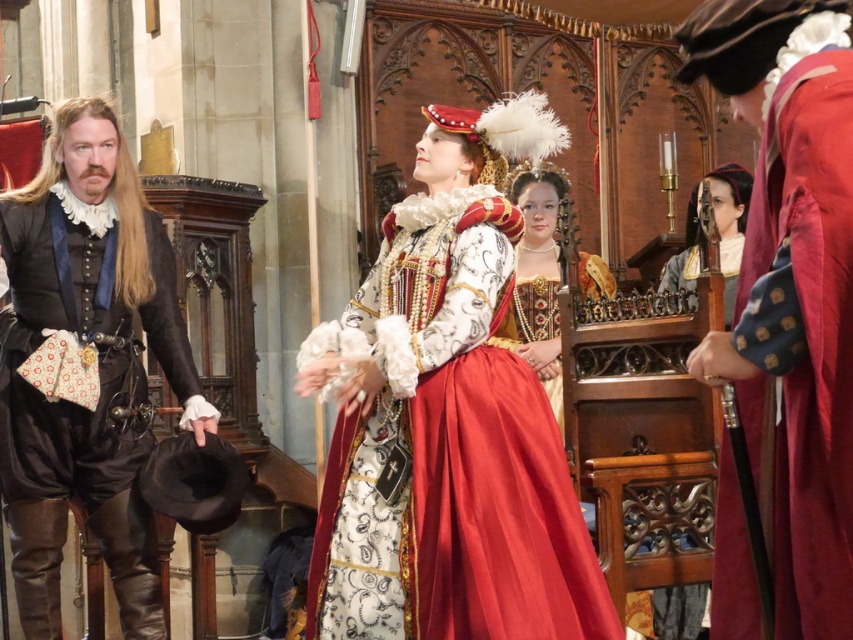
Which of these two, matte white lace dress at center or velvet maroon robe at right, stands shorter?

Standing shorter between the two is velvet maroon robe at right.

Between matte white lace dress at center and velvet maroon robe at right, which one is positioned higher?

velvet maroon robe at right is above.

The image size is (853, 640). Identify the location of matte white lace dress at center. (447, 420).

From the picture: Who is more forward, (62, 406) or (677, 291)?

Point (62, 406) is in front.

Looking at this image, is matte black vest at left further to camera compared to silk lace collar at upper center?

Yes, it is.

Describe the element at coordinates (90, 365) in the screenshot. I see `matte black vest at left` at that location.

The image size is (853, 640). What are the coordinates of `matte black vest at left` in the screenshot? It's located at (90, 365).

Can you confirm if matte white lace dress at center is shorter than silk lace collar at upper center?

No.

Which is more to the right, matte white lace dress at center or silk lace collar at upper center?

Positioned to the right is silk lace collar at upper center.

What do you see at coordinates (447, 420) in the screenshot?
I see `matte white lace dress at center` at bounding box center [447, 420].

This screenshot has height=640, width=853. Identify the location of matte white lace dress at center. (447, 420).